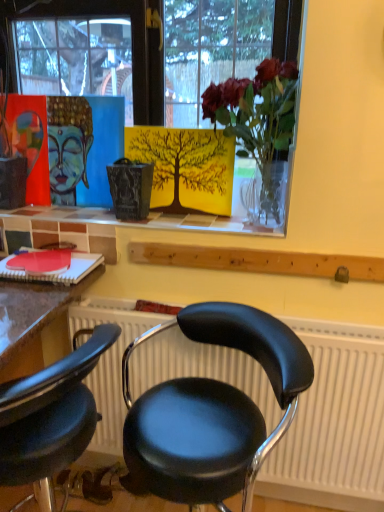
This screenshot has height=512, width=384. What do you see at coordinates (68, 146) in the screenshot? I see `matte acrylic painting of buddha head at upper left` at bounding box center [68, 146].

What do you see at coordinates (212, 410) in the screenshot?
I see `black leather chair at center, the 2th chair positioned from the left` at bounding box center [212, 410].

Image resolution: width=384 pixels, height=512 pixels. I want to click on black leather chair at lower left, which is counted as the 1th chair, starting from the left, so click(x=50, y=415).

This screenshot has height=512, width=384. Find the location of `translucent glass vase at upper center`. translucent glass vase at upper center is located at coordinates (259, 125).

From a real-world perspective, is black leather chair at lower left, marked as the 2th chair in a right-to-left arrangement, beneath matte glass vase at upper center?

Indeed, from a real-world perspective, black leather chair at lower left, marked as the 2th chair in a right-to-left arrangement, is positioned beneath matte glass vase at upper center.

From the image's perspective, is black leather chair at lower left, which is counted as the 1th chair, starting from the left, above or below matte glass vase at upper center?

Based on their image positions, black leather chair at lower left, which is counted as the 1th chair, starting from the left, is located beneath matte glass vase at upper center.

From the image's perspective, count 2nd chairs downward from the matte glass vase at upper center and point to it. Please provide its 2D coordinates.

[(50, 415)]

Considering the relative sizes of black leather chair at lower left, marked as the 2th chair in a right-to-left arrangement, and matte glass vase at upper center in the image provided, is black leather chair at lower left, marked as the 2th chair in a right-to-left arrangement, wider than matte glass vase at upper center?

Yes.

Is black leather chair at lower left, which is counted as the 1th chair, starting from the left, directly adjacent to black leather chair at center, the 2th chair positioned from the left?

No, black leather chair at lower left, which is counted as the 1th chair, starting from the left, is not making contact with black leather chair at center, the 2th chair positioned from the left.

In the image, there is a black leather chair at lower left, marked as the 2th chair in a right-to-left arrangement. Where is `chair above it (from the image's perspective)`? chair above it (from the image's perspective) is located at coordinates (212, 410).

From the image's perspective, is black leather chair at lower left, which is counted as the 1th chair, starting from the left, located above or below black leather chair at center, which is the first chair from right to left?

From the image's perspective, black leather chair at lower left, which is counted as the 1th chair, starting from the left, appears below black leather chair at center, which is the first chair from right to left.

Which object is thinner, black leather chair at lower left, marked as the 2th chair in a right-to-left arrangement, or black leather chair at center, the 2th chair positioned from the left?

Thinner between the two is black leather chair at lower left, marked as the 2th chair in a right-to-left arrangement.

From the image's perspective, does matte glass vase at upper center appear lower than black leather chair at lower left, which is counted as the 1th chair, starting from the left?

Actually, matte glass vase at upper center appears above black leather chair at lower left, which is counted as the 1th chair, starting from the left, in the image.

How much distance is there between matte glass vase at upper center and black leather chair at lower left, which is counted as the 1th chair, starting from the left?

55.03 centimeters.

Considering the sizes of matte glass vase at upper center and black leather chair at lower left, which is counted as the 1th chair, starting from the left, in the image, is matte glass vase at upper center wider or thinner than black leather chair at lower left, which is counted as the 1th chair, starting from the left,?

In the image, matte glass vase at upper center appears to be more narrow than black leather chair at lower left, which is counted as the 1th chair, starting from the left.

Does matte glass vase at upper center have a smaller size compared to black leather chair at lower left, which is counted as the 1th chair, starting from the left?

Yes.

How many degrees apart are the facing directions of black leather chair at center, which is the first chair from right to left, and translucent glass vase at upper center?

They differ by 91.2 degrees in their facing directions.

Which of these two, black leather chair at center, which is the first chair from right to left, or translucent glass vase at upper center, is bigger?

Bigger between the two is black leather chair at center, which is the first chair from right to left.

Considering the positions of objects black leather chair at center, which is the first chair from right to left, and translucent glass vase at upper center in the image provided, who is in front, black leather chair at center, which is the first chair from right to left, or translucent glass vase at upper center?

Positioned in front is black leather chair at center, which is the first chair from right to left.

Is black leather chair at center, which is the first chair from right to left, spatially inside translucent glass vase at upper center, or outside of it?

black leather chair at center, which is the first chair from right to left, is not enclosed by translucent glass vase at upper center.

From the image's perspective, which is below, translucent glass vase at upper center or black leather chair at center, the 2th chair positioned from the left?

black leather chair at center, the 2th chair positioned from the left, from the image's perspective.

Considering the relative sizes of translucent glass vase at upper center and black leather chair at center, which is the first chair from right to left, in the image provided, is translucent glass vase at upper center wider than black leather chair at center, which is the first chair from right to left,?

Incorrect, the width of translucent glass vase at upper center does not surpass that of black leather chair at center, which is the first chair from right to left.

Based on the photo, can we say black leather chair at lower left, which is counted as the 1th chair, starting from the left, lies outside matte acrylic painting of buddha head at upper left?

Yes, black leather chair at lower left, which is counted as the 1th chair, starting from the left, is outside of matte acrylic painting of buddha head at upper left.

Does point (51, 430) lie behind point (55, 104)?

No.

Is black leather chair at lower left, marked as the 2th chair in a right-to-left arrangement, positioned with its back to matte acrylic painting of buddha head at upper left?

No, black leather chair at lower left, marked as the 2th chair in a right-to-left arrangement, is not facing the opposite direction of matte acrylic painting of buddha head at upper left.

Considering the relative sizes of black leather chair at lower left, marked as the 2th chair in a right-to-left arrangement, and matte acrylic painting of buddha head at upper left in the image provided, is black leather chair at lower left, marked as the 2th chair in a right-to-left arrangement, wider than matte acrylic painting of buddha head at upper left?

Yes, black leather chair at lower left, marked as the 2th chair in a right-to-left arrangement, is wider than matte acrylic painting of buddha head at upper left.

From the image's perspective, which one is positioned lower, matte glass vase at upper center or matte acrylic painting of buddha head at upper left?

matte glass vase at upper center.

Is the surface of matte glass vase at upper center in direct contact with matte acrylic painting of buddha head at upper left?

They are not placed beside each other.

This screenshot has height=512, width=384. In the image, there is a matte glass vase at upper center. Identify the location of art above it (from the image's perspective). (68, 146).

Which object is wider, matte glass vase at upper center or matte acrylic painting of buddha head at upper left?

matte glass vase at upper center.

The image size is (384, 512). Identify the location of window sill lying on the right of black leather chair at lower left, marked as the 2th chair in a right-to-left arrangement. (121, 222).

Where is `chair in front of the black leather chair at lower left, which is counted as the 1th chair, starting from the left`? This screenshot has height=512, width=384. chair in front of the black leather chair at lower left, which is counted as the 1th chair, starting from the left is located at coordinates (212, 410).

From the image, which object appears to be farther from black leather chair at lower left, which is counted as the 1th chair, starting from the left, matte acrylic painting of buddha head at upper left or translucent glass vase at upper center?

translucent glass vase at upper center is positioned further to the anchor black leather chair at lower left, which is counted as the 1th chair, starting from the left.

Looking at this image, considering their positions, is black leather chair at center, the 2th chair positioned from the left, positioned further to matte acrylic painting of buddha head at upper left than matte glass vase at upper center?

black leather chair at center, the 2th chair positioned from the left, is further to matte acrylic painting of buddha head at upper left.

Looking at the image, which one is located further to matte glass vase at upper center, matte acrylic painting of buddha head at upper left or black leather chair at center, the 2th chair positioned from the left?

The object further to matte glass vase at upper center is black leather chair at center, the 2th chair positioned from the left.

Based on their spatial positions, is black leather chair at lower left, which is counted as the 1th chair, starting from the left, or matte glass vase at upper center closer to translucent glass vase at upper center?

matte glass vase at upper center lies closer to translucent glass vase at upper center than the other object.

From the image, which object appears to be nearer to translucent glass vase at upper center, black leather chair at center, which is the first chair from right to left, or matte glass vase at upper center?

matte glass vase at upper center is positioned closer to the anchor translucent glass vase at upper center.

When comparing their distances from black leather chair at lower left, marked as the 2th chair in a right-to-left arrangement, does black leather chair at center, the 2th chair positioned from the left, or matte glass vase at upper center seem further?

Based on the image, matte glass vase at upper center appears to be further to black leather chair at lower left, marked as the 2th chair in a right-to-left arrangement.

Considering their positions, is matte acrylic painting of buddha head at upper left positioned further to black leather chair at center, which is the first chair from right to left, than matte glass vase at upper center?

Based on the image, matte acrylic painting of buddha head at upper left appears to be further to black leather chair at center, which is the first chair from right to left.

Considering their positions, is black leather chair at lower left, which is counted as the 1th chair, starting from the left, positioned further to translucent glass vase at upper center than black leather chair at center, the 2th chair positioned from the left?

black leather chair at lower left, which is counted as the 1th chair, starting from the left, is positioned further to the anchor translucent glass vase at upper center.

Where is `window sill that lies between matte acrylic painting of buddha head at upper left and black leather chair at lower left, marked as the 2th chair in a right-to-left arrangement, from top to bottom`? This screenshot has height=512, width=384. window sill that lies between matte acrylic painting of buddha head at upper left and black leather chair at lower left, marked as the 2th chair in a right-to-left arrangement, from top to bottom is located at coordinates (121, 222).

At what (x,y) coordinates should I click in order to perform the action: click on floral arrangement between matte acrylic painting of buddha head at upper left and black leather chair at lower left, marked as the 2th chair in a right-to-left arrangement, vertically. Please return your answer as a coordinate pair (x, y). This screenshot has height=512, width=384. Looking at the image, I should click on (259, 125).

The width and height of the screenshot is (384, 512). Identify the location of chair between matte acrylic painting of buddha head at upper left and black leather chair at lower left, which is counted as the 1th chair, starting from the left, in the up-down direction. (212, 410).

Find the location of a particular element. This screenshot has height=512, width=384. chair between translucent glass vase at upper center and black leather chair at lower left, marked as the 2th chair in a right-to-left arrangement, in the up-down direction is located at coordinates (212, 410).